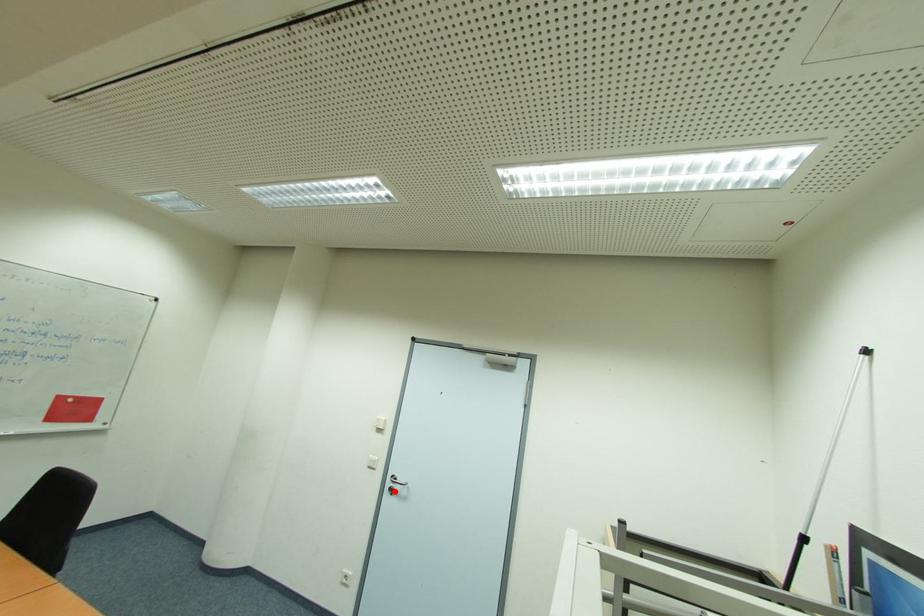
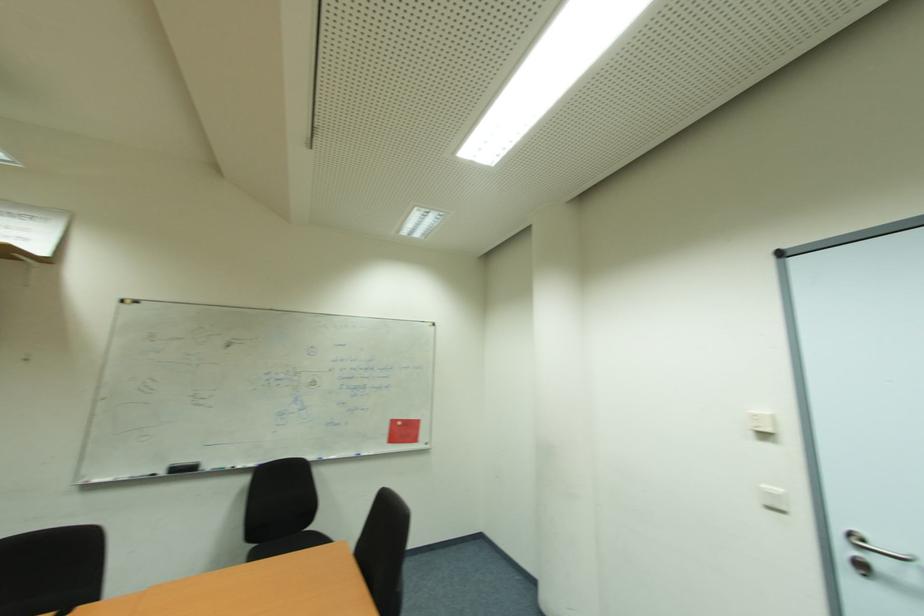
Where in the second image is the point corresponding to the highlighted location from the first image?

(869, 570)